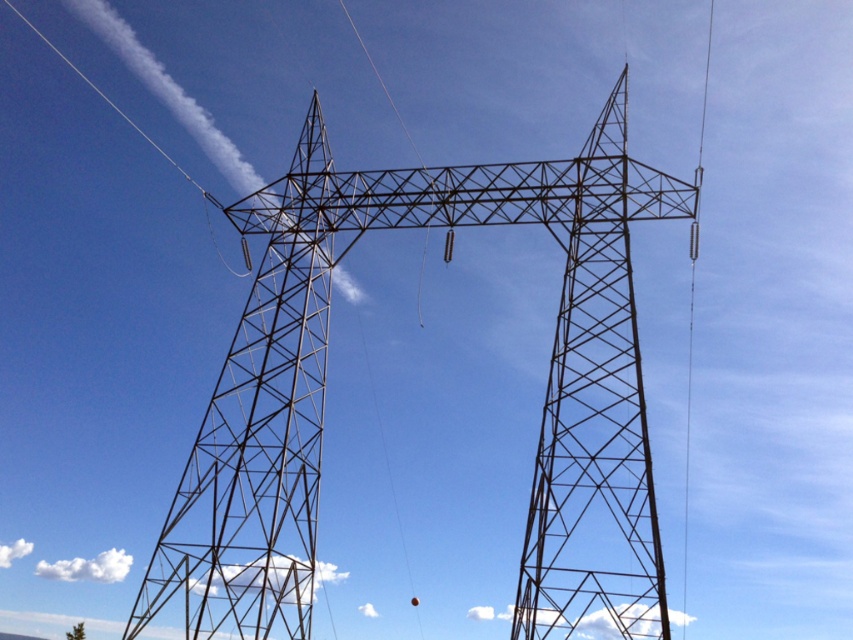
Is metallic structure at center positioned behind metallic structure at left?

No, metallic structure at center is closer to the viewer.

Locate an element on the screen. metallic structure at center is located at coordinates (325, 385).

Is metallic structure at left below metallic wire at right?

Correct, metallic structure at left is located below metallic wire at right.

Does metallic structure at left have a lesser width compared to metallic wire at right?

Incorrect, metallic structure at left's width is not less than metallic wire at right's.

The height and width of the screenshot is (640, 853). What do you see at coordinates (259, 428) in the screenshot?
I see `metallic structure at left` at bounding box center [259, 428].

Where is `metallic structure at left`? metallic structure at left is located at coordinates (259, 428).

Is metallic structure at center wider than metallic wire at right?

Yes, metallic structure at center is wider than metallic wire at right.

Between point (624, 129) and point (686, 380), which one is positioned in front?

Point (686, 380) is in front.

Which is in front, point (251, 422) or point (699, 168)?

Point (251, 422) is more forward.

At what (x,y) coordinates should I click in order to perform the action: click on metallic structure at center. Please return your answer as a coordinate pair (x, y). The image size is (853, 640). Looking at the image, I should click on (325, 385).